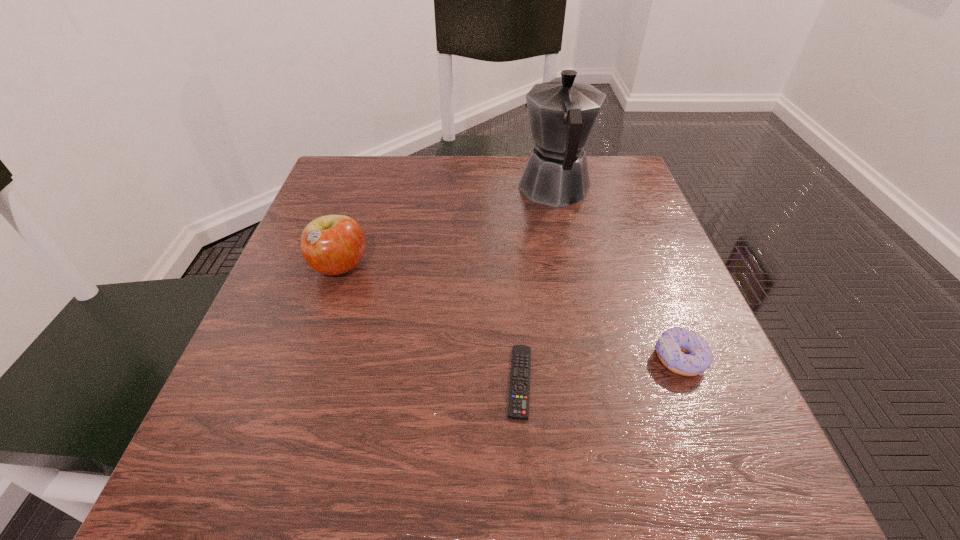
You are a GUI agent. You are given a task and a screenshot of the screen. Output one action in this format:
    pyautogui.click(x=<x>, y=<y>)
    Task: Click on the free region at the near left corner of the desktop
    
    Given the screenshot: What is the action you would take?
    pyautogui.click(x=269, y=460)

Identify the location of blank space at the far right corner. (596, 174).

The image size is (960, 540). Identify the location of vacant space at the near right corner of the desktop. (680, 447).

You are a GUI agent. You are given a task and a screenshot of the screen. Output one action in this format:
    pyautogui.click(x=<x>, y=<y>)
    Task: Click on the unoccupied position between the third tallest object and the shortest object
    Image resolution: width=960 pixels, height=540 pixels.
    Given the screenshot: What is the action you would take?
    pyautogui.click(x=600, y=370)

You are a GUI agent. You are given a task and a screenshot of the screen. Output one action in this format:
    pyautogui.click(x=<x>, y=<y>)
    Task: Click on the empty space that is in between the second shortest object and the leftmost object
    
    Given the screenshot: What is the action you would take?
    pyautogui.click(x=510, y=313)

Where is `free space between the third shortest object and the second object from left to right`? The width and height of the screenshot is (960, 540). free space between the third shortest object and the second object from left to right is located at coordinates pos(430,325).

This screenshot has width=960, height=540. Identify the location of free area in between the farthest object and the remote control. (538, 285).

Image resolution: width=960 pixels, height=540 pixels. Find the location of `vacant space that's between the farthest object and the second object from left to right`. vacant space that's between the farthest object and the second object from left to right is located at coordinates (538, 285).

What are the coordinates of `free spot between the shortest object and the apple` in the screenshot? It's located at (430, 325).

Find the location of a particular element. vacant area that lies between the shortest object and the coffeepot is located at coordinates (538, 285).